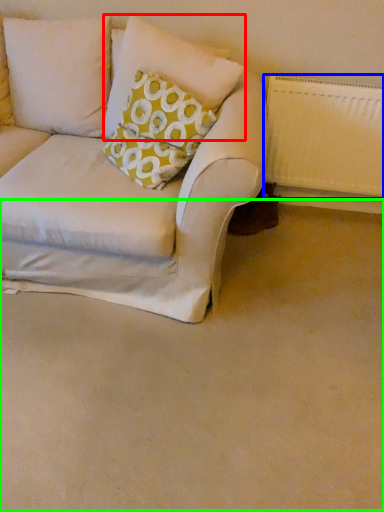
Question: Which object is the farthest from pillow (highlighted by a red box)? Choose among these: radiator (highlighted by a blue box) or plain (highlighted by a green box).

Choices:
 (A) radiator
 (B) plain

Answer: (B)